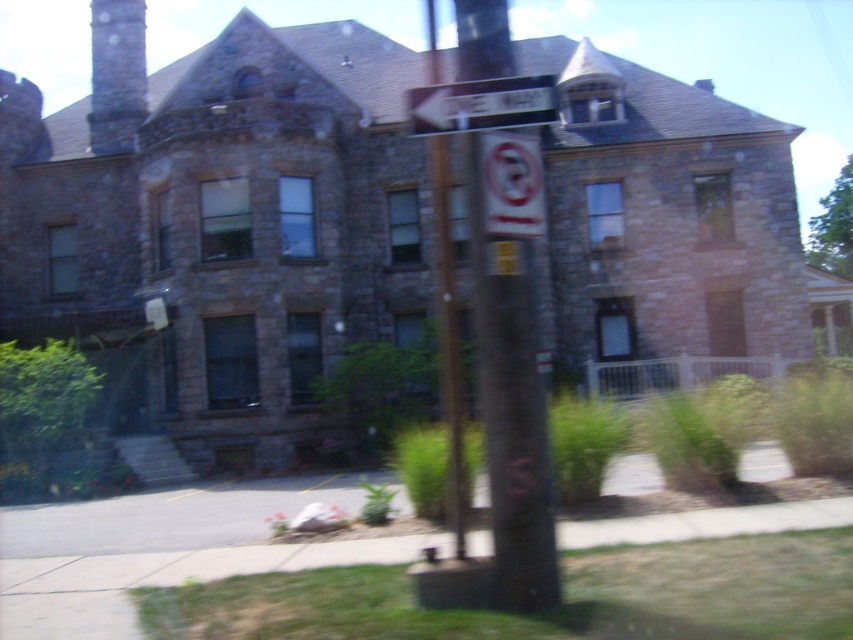
You are driving a car and see the dark brown wood post at center and the white plastic sign at upper center ahead. According to the scene, which object is closer to you?

The dark brown wood post at center is closer to you because it is in front of the white plastic sign at upper center.